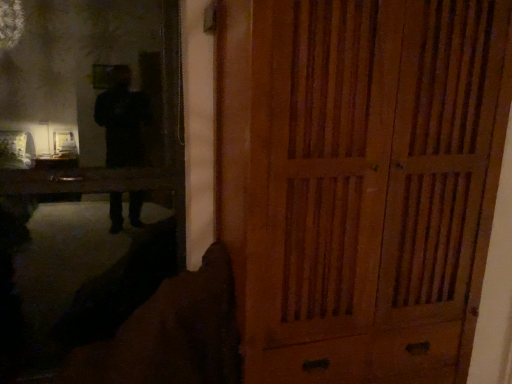
Question: Is wooden cabinet at right taller than matte black mirror at upper left?

Choices:
 (A) yes
 (B) no

Answer: (A)

Question: From the image's perspective, is wooden cabinet at right under matte black mirror at upper left?

Choices:
 (A) yes
 (B) no

Answer: (A)

Question: Considering the relative sizes of wooden cabinet at right and matte black mirror at upper left in the image provided, is wooden cabinet at right smaller than matte black mirror at upper left?

Choices:
 (A) no
 (B) yes

Answer: (A)

Question: Is wooden cabinet at right oriented away from matte black mirror at upper left?

Choices:
 (A) no
 (B) yes

Answer: (A)

Question: Is wooden cabinet at right not inside matte black mirror at upper left?

Choices:
 (A) yes
 (B) no

Answer: (A)

Question: Does wooden cabinet at right appear on the right side of matte black mirror at upper left?

Choices:
 (A) no
 (B) yes

Answer: (B)

Question: Is matte black mirror at upper left positioned beyond the bounds of wooden cabinet at right?

Choices:
 (A) no
 (B) yes

Answer: (B)

Question: Is matte black mirror at upper left shorter than wooden cabinet at right?

Choices:
 (A) no
 (B) yes

Answer: (B)

Question: Does matte black mirror at upper left appear on the right side of wooden cabinet at right?

Choices:
 (A) yes
 (B) no

Answer: (B)

Question: From a real-world perspective, does matte black mirror at upper left stand above wooden cabinet at right?

Choices:
 (A) yes
 (B) no

Answer: (B)

Question: Is matte black mirror at upper left wider than wooden cabinet at right?

Choices:
 (A) yes
 (B) no

Answer: (B)

Question: Could you tell me if matte black mirror at upper left is turned towards wooden cabinet at right?

Choices:
 (A) yes
 (B) no

Answer: (B)

Question: Looking at their shapes, would you say wooden cabinet at right is wider or thinner than matte black mirror at upper left?

Choices:
 (A) thin
 (B) wide

Answer: (B)